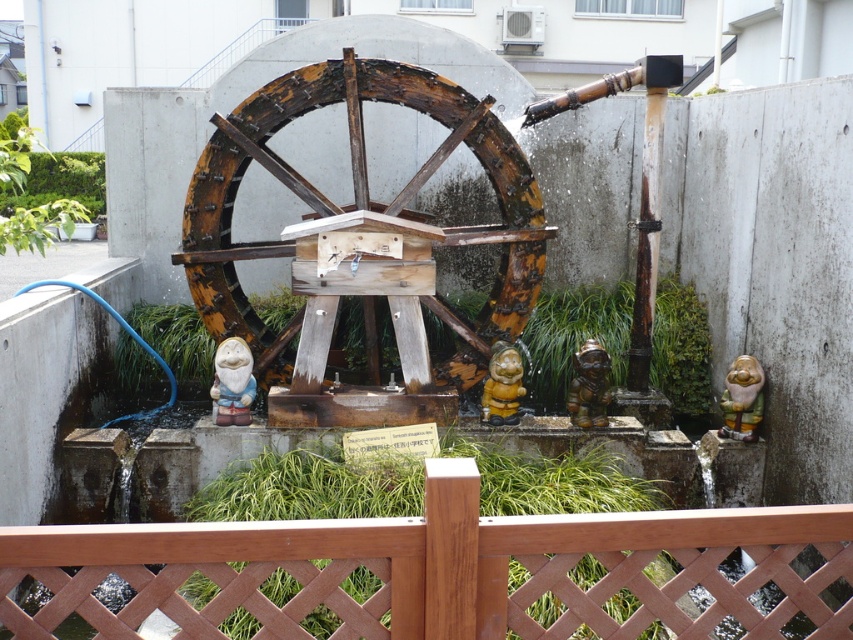
Does brown wooden fence at center appear on the right side of white glossy gnome at center?

Yes, brown wooden fence at center is to the right of white glossy gnome at center.

This screenshot has width=853, height=640. What do you see at coordinates (444, 572) in the screenshot?
I see `brown wooden fence at center` at bounding box center [444, 572].

Identify the location of brown wooden fence at center. (444, 572).

Locate an element on the screen. The height and width of the screenshot is (640, 853). white glossy gnome at center is located at coordinates (231, 381).

Based on the photo, is the position of white glossy gnome at center more distant than that of brown matte figurine at center?

No, it is in front of brown matte figurine at center.

Is point (233, 355) farther from viewer compared to point (592, 392)?

No, (233, 355) is in front of (592, 392).

I want to click on white glossy gnome at center, so click(231, 381).

Is green glazed ceramic gnome at center shorter than yellow matte figurine at center?

In fact, green glazed ceramic gnome at center may be taller than yellow matte figurine at center.

Does green glazed ceramic gnome at center appear on the right side of yellow matte figurine at center?

Correct, you'll find green glazed ceramic gnome at center to the right of yellow matte figurine at center.

Who is more distant from viewer, (729, 410) or (480, 410)?

Positioned behind is point (729, 410).

I want to click on green glazed ceramic gnome at center, so click(x=741, y=400).